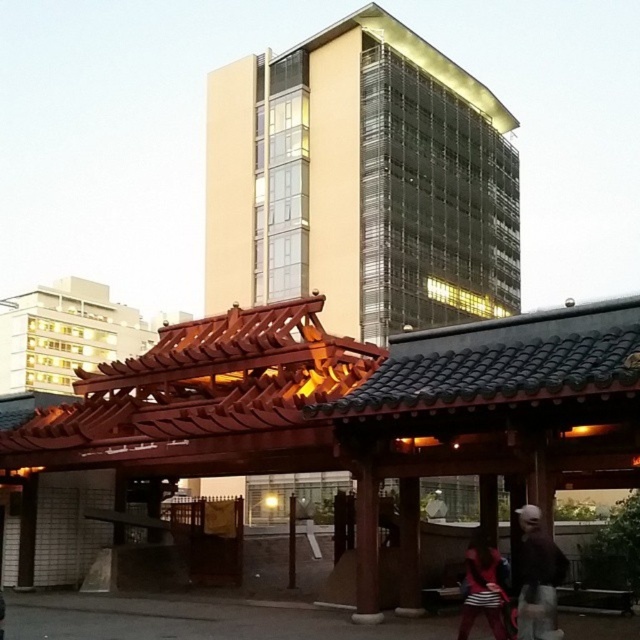
You are a delivery person standing at the entrance of the traditional structure. You need to place a package between the dark brown leather jacket at lower right and the striped fabric bag at lower right. Can you fit the package if it measures 25 inches in length?

The distance between the dark brown leather jacket at lower right and the striped fabric bag at lower right is 27.02 inches. Since the package is 25 inches long, it can fit between them as there is enough space.

You are standing at the entrance of the traditional East Asian structure and want to take a photo of the modern highrise building. Your camera is 6.84 meters away from the dark brown leather jacket at lower right. Can you determine if the camera is within reach without moving from your current position?

The camera is 6.84 meters away from the dark brown leather jacket at lower right, so if you are at the entrance of the traditional East Asian structure, the camera might be out of reach unless you can extend your arm that far. However, since the exact distance from you to the jacket isn not specified, it is hard to determine precisely.